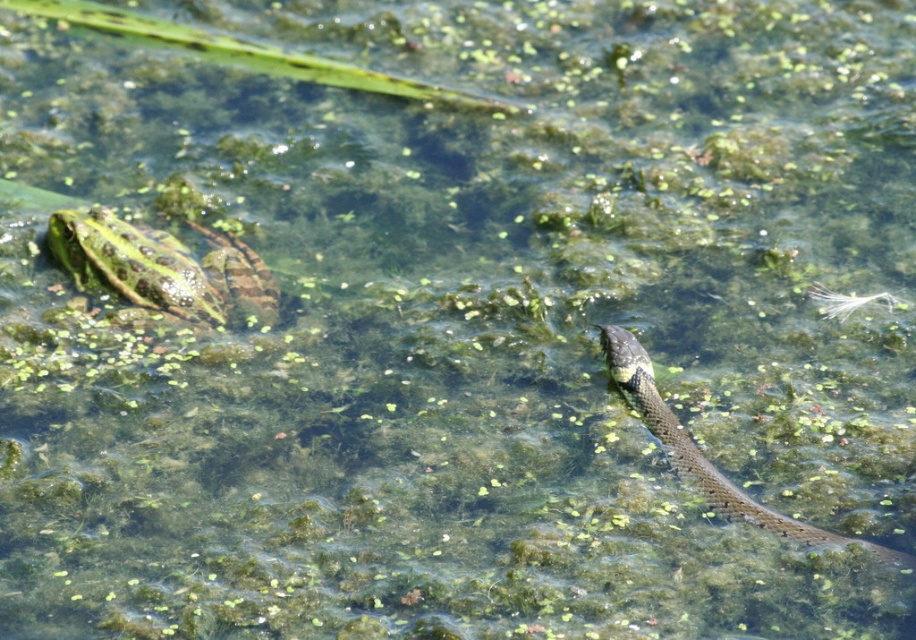
You are a wildlife photographer trying to capture both the speckled green skin at upper left and the green spotted skin at upper left in the same frame. Based on their widths, which one might require you to adjust your camera angle to avoid cropping?

The green spotted skin at upper left requires adjusting the camera angle because it is wider than the speckled green skin at upper left, so it might be partially cropped if not framed properly.

You are a photographer aiming to capture both the speckled green skin at upper left and the green spotted skin at upper left in a single shot. Which one is closer to your camera lens?

The speckled green skin at upper left is closer to the camera lens because it is further to the viewer than the green spotted skin at upper left.

You are a wildlife photographer aiming to capture both the speckled green skin at upper left and the green spotted skin at upper left in a single frame. Based on their positions, which one is positioned higher in the image?

The speckled green skin at upper left is located above the green spotted skin at upper left, so it is positioned higher in the image.